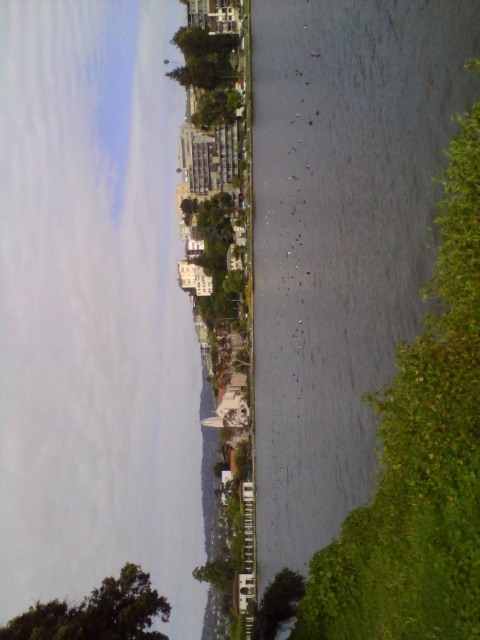
You are standing on the dock and see the green leafy tree at lower right and the green leafy tree at lower center. Which tree is closer to the water surface?

The green leafy tree at lower center is closer to the water surface because the green leafy tree at lower right is above it.

You are standing at the point closest to the water in the image. There are two points marked on the image, one at coordinates point (x=73, y=456) and the other at point (x=120, y=634). Which point is farther away from you?

Point (x=73, y=456) is behind point (x=120, y=634), so the point farther away from you is point (x=73, y=456).